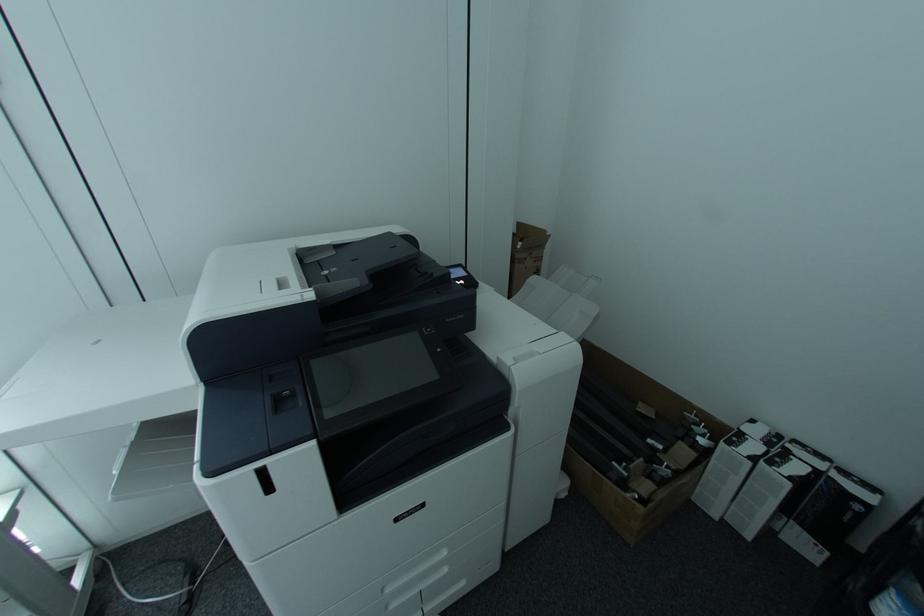
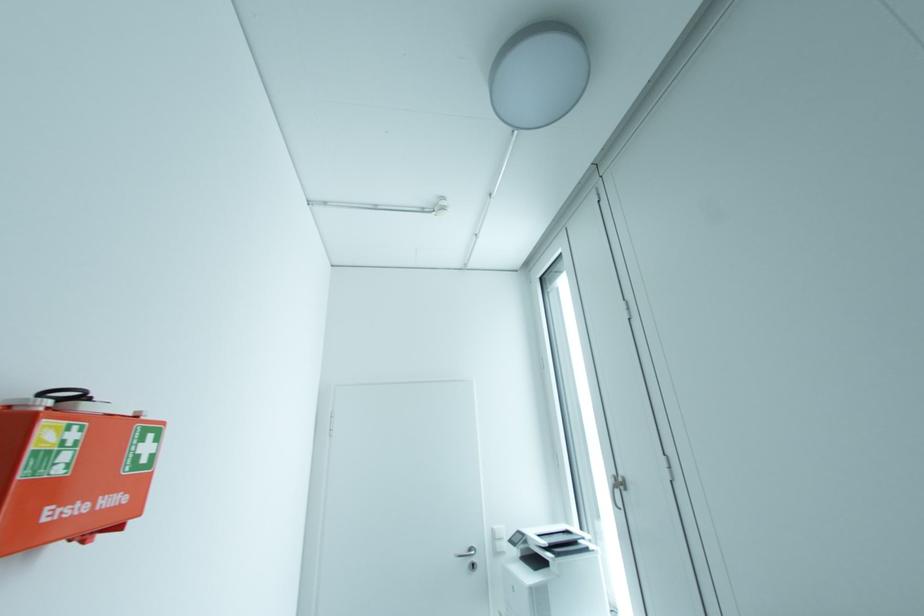
Question: The first image is from the beginning of the video and the second image is from the end. How did the camera likely rotate when shooting the video?

Choices:
 (A) Left
 (B) Right
 (C) Up
 (D) Down

Answer: (A)